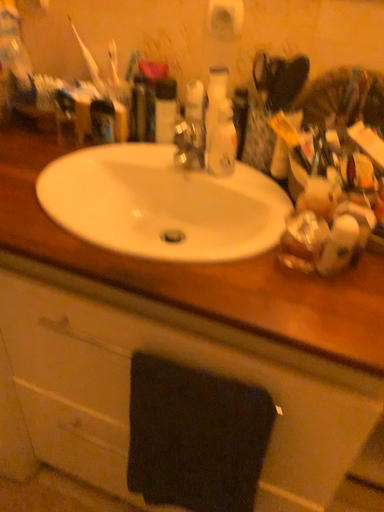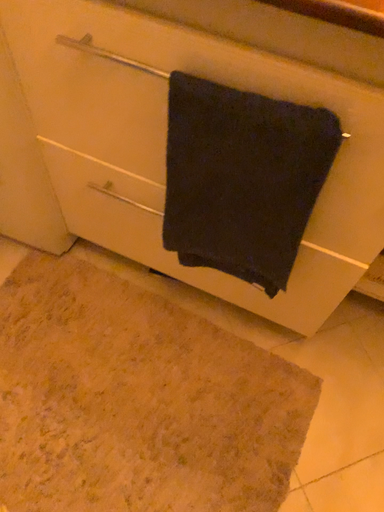
Question: Which way did the camera rotate in the video?

Choices:
 (A) rotated downward
 (B) rotated upward

Answer: (A)